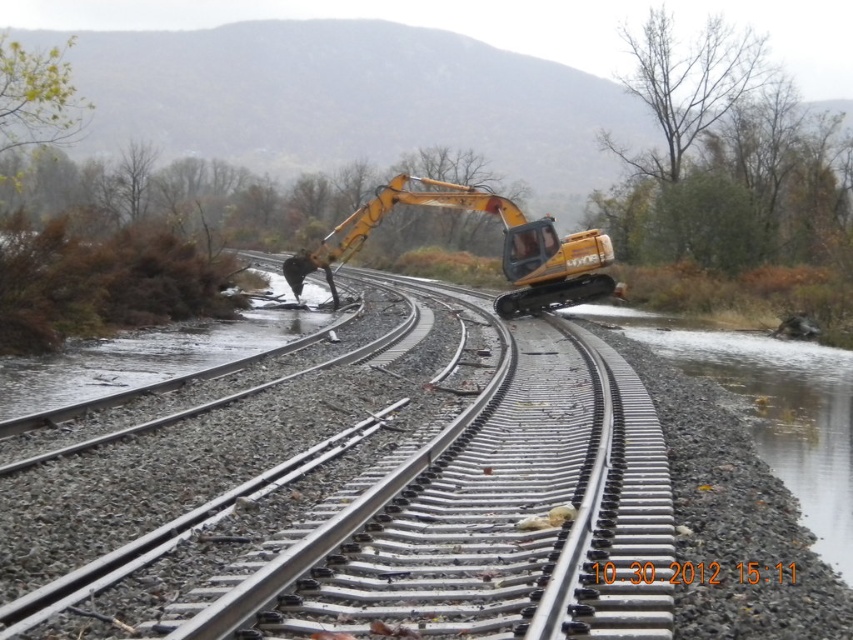
Question: Which of these objects is positioned closest to the clear water at bottom right?

Choices:
 (A) yellow rubber excavator at center
 (B) metal train track at center

Answer: (B)

Question: Does clear water at bottom right come in front of yellow rubber excavator at center?

Choices:
 (A) yes
 (B) no

Answer: (A)

Question: Does clear water at bottom right have a larger size compared to yellow rubber excavator at center?

Choices:
 (A) no
 (B) yes

Answer: (A)

Question: Which of the following is the closest to the observer?

Choices:
 (A) yellow rubber excavator at center
 (B) clear water at bottom right
 (C) metal train track at center

Answer: (C)

Question: In this image, where is clear water at bottom right located relative to yellow rubber excavator at center?

Choices:
 (A) below
 (B) above

Answer: (A)

Question: Among these objects, which one is nearest to the camera?

Choices:
 (A) yellow rubber excavator at center
 (B) metal train track at center

Answer: (B)